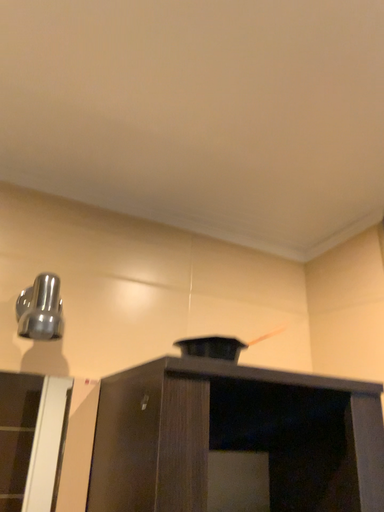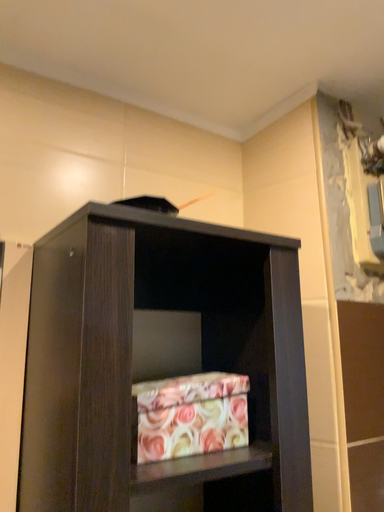
Question: How did the camera likely rotate when shooting the video?

Choices:
 (A) rotated right
 (B) rotated left

Answer: (A)